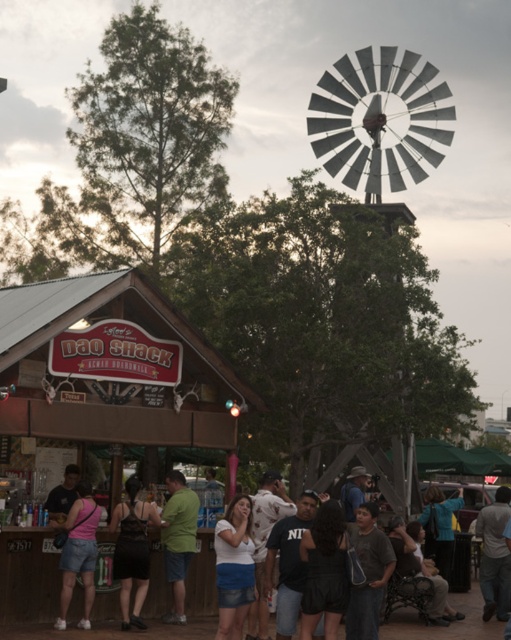
Does black mesh tank top at lower left appear on the left side of green cotton shirt at center?

Indeed, black mesh tank top at lower left is positioned on the left side of green cotton shirt at center.

Is black mesh tank top at lower left bigger than green cotton shirt at center?

Yes.

Which is behind, point (134, 548) or point (180, 592)?

The point (180, 592) is behind.

Locate an element on the screen. The image size is (511, 640). black mesh tank top at lower left is located at coordinates (132, 550).

Who is more forward, (x=366, y=541) or (x=493, y=529)?

Point (x=366, y=541) is more forward.

What do you see at coordinates (368, 573) in the screenshot?
I see `matte gray shirt at lower center` at bounding box center [368, 573].

The height and width of the screenshot is (640, 511). Find the location of `matte gray shirt at lower center`. matte gray shirt at lower center is located at coordinates (368, 573).

Is black mesh tank top at lower left shorter than pink denim shorts at lower left?

No, black mesh tank top at lower left is not shorter than pink denim shorts at lower left.

Identify the location of black mesh tank top at lower left. (132, 550).

Does point (135, 600) lie in front of point (74, 576)?

No.

Find the location of a particular element. black mesh tank top at lower left is located at coordinates (132, 550).